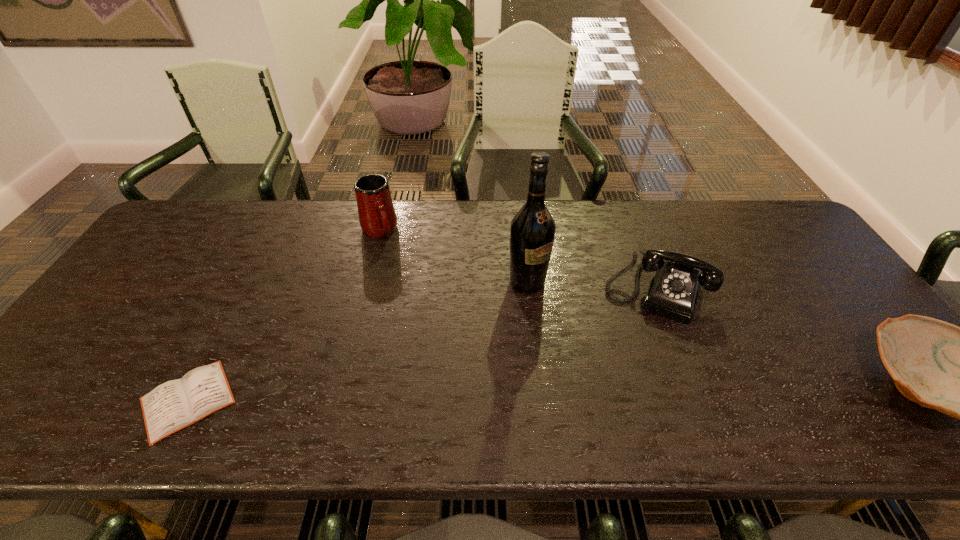
At what (x,y) coordinates should I click in order to perform the action: click on free spot that satisfies the following two spatial constraints: 1. on the front side of the fourth object from right to left; 2. on the left side of the tallest object. Please return your answer as a coordinate pair (x, y). Image resolution: width=960 pixels, height=540 pixels. Looking at the image, I should click on (366, 282).

Locate an element on the screen. The height and width of the screenshot is (540, 960). vacant area that satisfies the following two spatial constraints: 1. on the front side of the telephone; 2. on the right side of the third object from left to right is located at coordinates (528, 290).